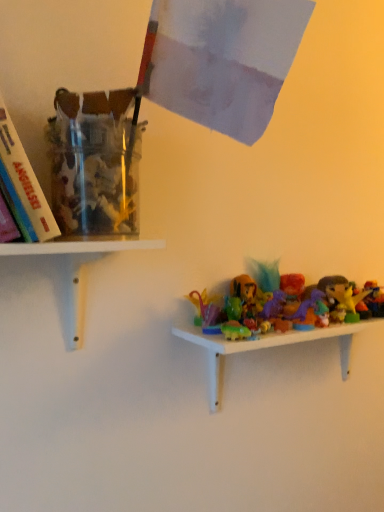
Question: Does point (x=314, y=331) appear closer or farther from the camera than point (x=26, y=250)?

Choices:
 (A) farther
 (B) closer

Answer: (A)

Question: Looking at their shapes, would you say plastic toy figures at lower right, marked as the 2th shelf in a top-to-bottom arrangement, is wider or thinner than white matte shelf at lower left, acting as the second shelf starting from the right?

Choices:
 (A) thin
 (B) wide

Answer: (A)

Question: Considering the positions of plastic toy figures at lower right, marked as the 2th shelf in a top-to-bottom arrangement, and white matte shelf at lower left, positioned as the first shelf in top-to-bottom order, in the image, is plastic toy figures at lower right, marked as the 2th shelf in a top-to-bottom arrangement, bigger or smaller than white matte shelf at lower left, positioned as the first shelf in top-to-bottom order,?

Choices:
 (A) small
 (B) big

Answer: (B)

Question: In terms of height, does white matte shelf at lower left, positioned as the first shelf in top-to-bottom order, look taller or shorter compared to plastic toy figures at lower right, the second shelf in the left-to-right sequence?

Choices:
 (A) tall
 (B) short

Answer: (B)

Question: In the image, is white matte shelf at lower left, marked as the second shelf in a bottom-to-top arrangement, positioned in front of or behind plastic toy figures at lower right, the second shelf in the left-to-right sequence?

Choices:
 (A) behind
 (B) front

Answer: (B)

Question: Is white matte shelf at lower left, positioned as the first shelf in top-to-bottom order, wider or thinner than plastic toy figures at lower right, which is the first shelf from right to left?

Choices:
 (A) thin
 (B) wide

Answer: (B)

Question: Is white matte shelf at lower left, marked as the second shelf in a bottom-to-top arrangement, inside or outside of plastic toy figures at lower right, the second shelf in the left-to-right sequence?

Choices:
 (A) outside
 (B) inside

Answer: (A)